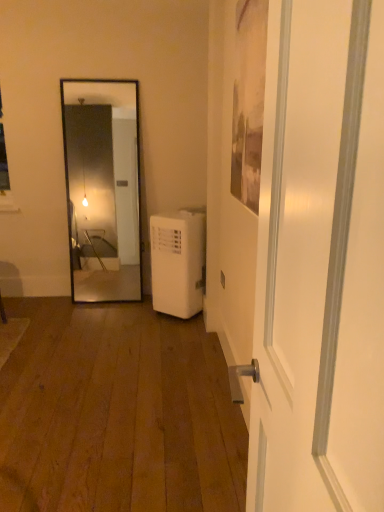
This screenshot has height=512, width=384. Describe the element at coordinates (320, 262) in the screenshot. I see `white glossy door at center` at that location.

The width and height of the screenshot is (384, 512). In order to click on white glossy door at center in this screenshot , I will do `click(320, 262)`.

Measure the distance between point (353, 272) and camera.

They are 18.54 inches apart.

The width and height of the screenshot is (384, 512). What do you see at coordinates (178, 262) in the screenshot?
I see `white plastic air conditioner at lower right` at bounding box center [178, 262].

Identify the location of white plastic air conditioner at lower right. The width and height of the screenshot is (384, 512). (178, 262).

In order to click on white glossy door at center in this screenshot , I will do `click(320, 262)`.

Considering the relative positions of white plastic air conditioner at lower right and white glossy door at center in the image provided, is white plastic air conditioner at lower right to the left of white glossy door at center from the viewer's perspective?

Yes.

Between white plastic air conditioner at lower right and white glossy door at center, which one is positioned behind?

Answer: white plastic air conditioner at lower right is behind.

Is point (151, 217) closer to camera compared to point (323, 200)?

No, (151, 217) is behind (323, 200).

From the image's perspective, between white plastic air conditioner at lower right and white glossy door at center, who is located below?

From the image's view, white glossy door at center is below.

From a real-world perspective, which object rests below the other?

white plastic air conditioner at lower right.

Does white plastic air conditioner at lower right have a greater width compared to white glossy door at center?

Correct, the width of white plastic air conditioner at lower right exceeds that of white glossy door at center.

Looking at this image, is white plastic air conditioner at lower right shorter than white glossy door at center?

Yes, white plastic air conditioner at lower right is shorter than white glossy door at center.

Between white plastic air conditioner at lower right and white glossy door at center, which one has larger size?

Bigger between the two is white plastic air conditioner at lower right.

Can white glossy door at center be found inside white plastic air conditioner at lower right?

No, white glossy door at center is not surrounded by white plastic air conditioner at lower right.

Is white plastic air conditioner at lower right beside white glossy door at center?

white plastic air conditioner at lower right is not next to white glossy door at center, and they're not touching.

Is white plastic air conditioner at lower right turned away from white glossy door at center?

No, white plastic air conditioner at lower right is not facing the opposite direction of white glossy door at center.

Can you tell me how much white plastic air conditioner at lower right and white glossy door at center differ in facing direction?

They differ by 0.636 degrees in their facing directions.

Locate an element on the screen. The image size is (384, 512). dish washer behind the white glossy door at center is located at coordinates (178, 262).

In the scene shown: Considering the relative positions of white glossy door at center and white plastic air conditioner at lower right in the image provided, is white glossy door at center to the left or to the right of white plastic air conditioner at lower right?

Clearly, white glossy door at center is on the right of white plastic air conditioner at lower right in the image.

In the image, is white glossy door at center positioned in front of or behind white plastic air conditioner at lower right?

In the image, white glossy door at center appears in front of white plastic air conditioner at lower right.

Which is nearer, (x=362, y=355) or (x=192, y=255)?

The point (x=362, y=355) is closer to the camera.

Based on the photo, from the image's perspective, between white glossy door at center and white plastic air conditioner at lower right, which one is located above?

white plastic air conditioner at lower right, from the image's perspective.

From a real-world perspective, is white glossy door at center located beneath white plastic air conditioner at lower right?

No, from a real-world perspective, white glossy door at center is not under white plastic air conditioner at lower right.

Considering the sizes of objects white glossy door at center and white plastic air conditioner at lower right in the image provided, who is thinner, white glossy door at center or white plastic air conditioner at lower right?

white glossy door at center is thinner.

Does white glossy door at center have a lesser height compared to white plastic air conditioner at lower right?

In fact, white glossy door at center may be taller than white plastic air conditioner at lower right.

Is white glossy door at center bigger than white plastic air conditioner at lower right?

Incorrect, white glossy door at center is not larger than white plastic air conditioner at lower right.

Is white glossy door at center spatially inside white plastic air conditioner at lower right, or outside of it?

white glossy door at center is spatially situated outside white plastic air conditioner at lower right.

Are white glossy door at center and white plastic air conditioner at lower right beside each other?

No, white glossy door at center is not making contact with white plastic air conditioner at lower right.

Could you tell me if white glossy door at center is turned towards white plastic air conditioner at lower right?

No, white glossy door at center is not turned towards white plastic air conditioner at lower right.

How many degrees apart are the facing directions of white glossy door at center and white plastic air conditioner at lower right?

The facing directions of white glossy door at center and white plastic air conditioner at lower right are 0.636 degrees apart.

Measure the distance between white glossy door at center and white plastic air conditioner at lower right.

The distance of white glossy door at center from white plastic air conditioner at lower right is 7.32 feet.

You are a GUI agent. You are given a task and a screenshot of the screen. Output one action in this format:
    pyautogui.click(x=<x>, y=<y>)
    Task: Click on the dish washer above the white glossy door at center (from the image's perspective)
    
    Given the screenshot: What is the action you would take?
    pyautogui.click(x=178, y=262)

The image size is (384, 512). Identify the location of door in front of the white plastic air conditioner at lower right. (320, 262).

The width and height of the screenshot is (384, 512). I want to click on door above the white plastic air conditioner at lower right (from a real-world perspective), so click(x=320, y=262).